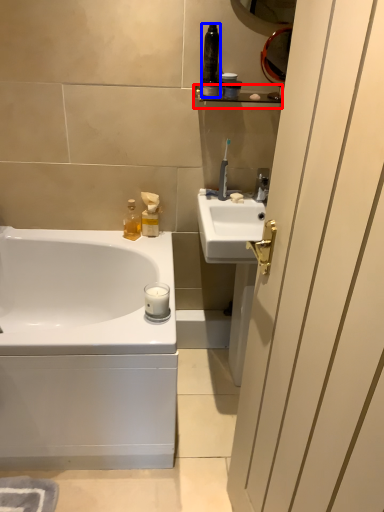
Question: Among these objects, which one is farthest to the camera, balustrade (highlighted by a red box) or toiletry (highlighted by a blue box)?

Choices:
 (A) balustrade
 (B) toiletry

Answer: (A)